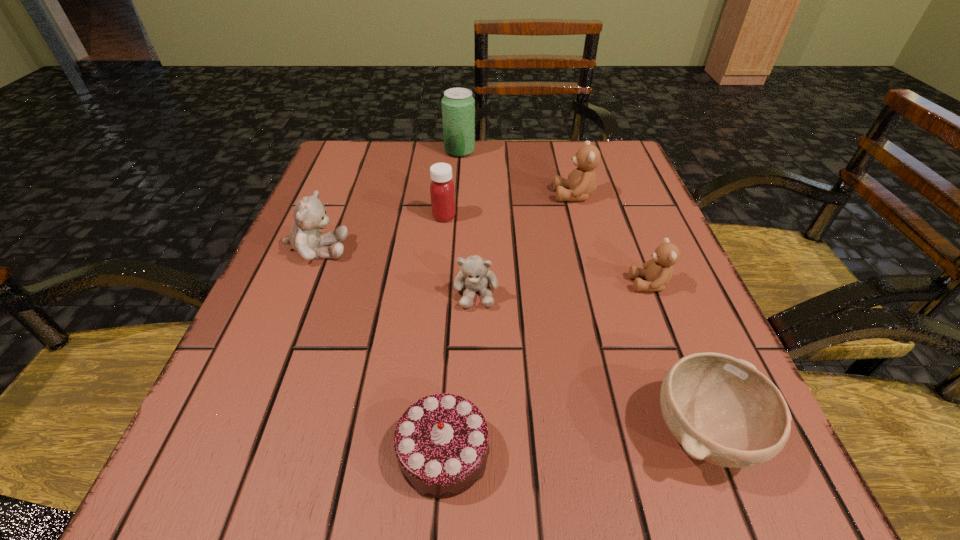
At what (x,y) coordinates should I click in order to perform the action: click on the farthest object. Please return your answer as a coordinate pair (x, y). Looking at the image, I should click on (458, 105).

This screenshot has height=540, width=960. In order to click on soda in this screenshot , I will do `click(458, 105)`.

Locate an element on the screen. Image resolution: width=960 pixels, height=540 pixels. the second teddy bear from right to left is located at coordinates (581, 182).

This screenshot has width=960, height=540. I want to click on the seventh nearest object, so click(581, 182).

The height and width of the screenshot is (540, 960). In order to click on the farther gray teddy bear in this screenshot , I will do `click(309, 213)`.

Where is `the bigger gray teddy bear`? the bigger gray teddy bear is located at coordinates (309, 213).

Find the location of a particular element. The height and width of the screenshot is (540, 960). red medicine is located at coordinates (442, 191).

This screenshot has width=960, height=540. What are the coordinates of `medicine` in the screenshot? It's located at (442, 191).

This screenshot has height=540, width=960. I want to click on the right brown teddy bear, so click(x=657, y=271).

This screenshot has height=540, width=960. Identify the location of the smaller brown teddy bear. (657, 271).